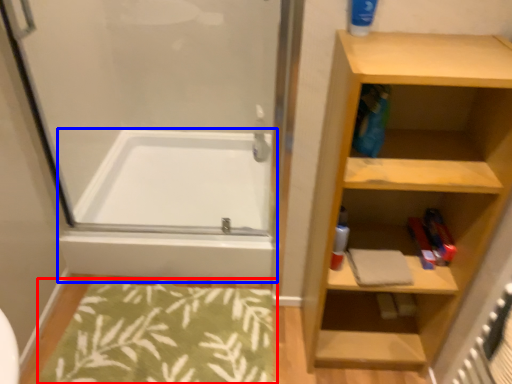
Question: Which point is closer to the camera, bath mat (highlighted by a red box) or bathtub (highlighted by a blue box)?

Choices:
 (A) bath mat
 (B) bathtub

Answer: (A)